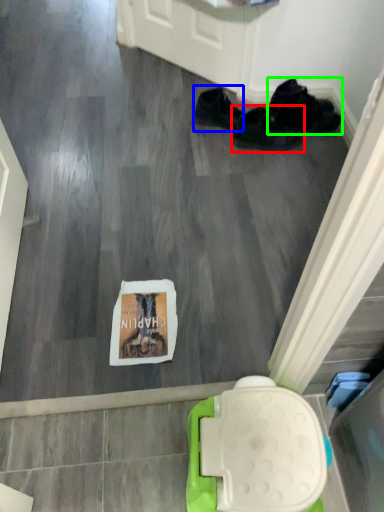
Question: Which object is the farthest from footwear (highlighted by a red box)? Choose among these: footwear (highlighted by a blue box) or footwear (highlighted by a green box).

Choices:
 (A) footwear
 (B) footwear

Answer: (A)